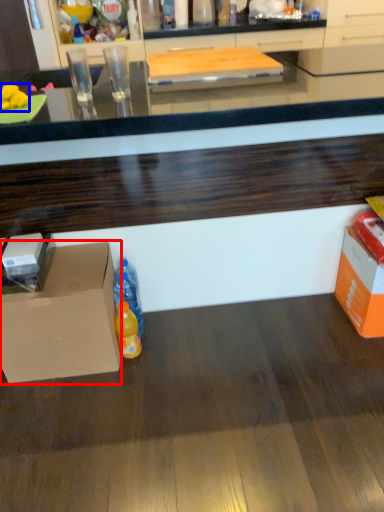
Question: Which object is closer to the camera taking this photo, cardboard box (highlighted by a red box) or food (highlighted by a blue box)?

Choices:
 (A) cardboard box
 (B) food

Answer: (B)